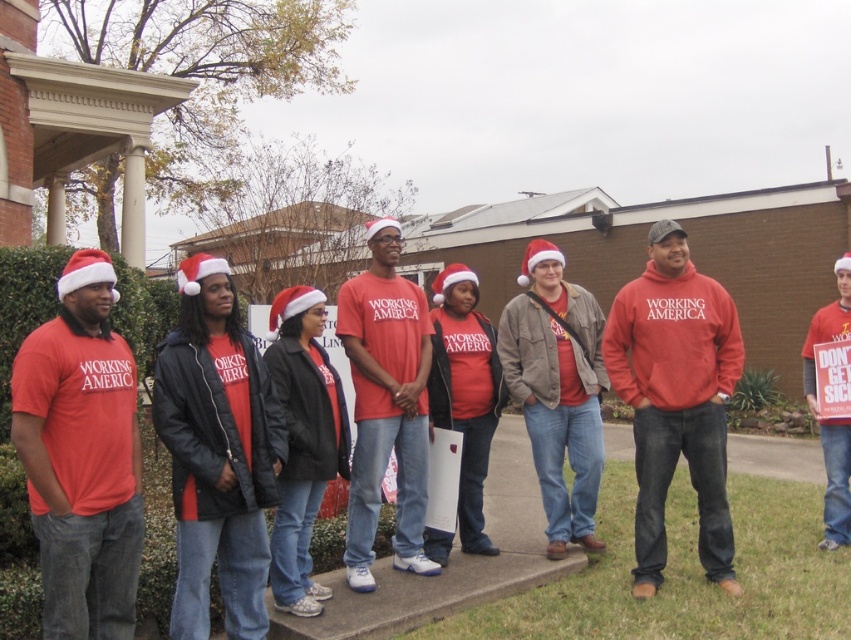
Question: Observing the image, what is the correct spatial positioning of matte red shirt at center in reference to matte red sweatshirt at center?

Choices:
 (A) above
 (B) below

Answer: (A)

Question: Where is matte red t-shirt at center located in relation to matte red sweatshirt at center in the image?

Choices:
 (A) left
 (B) right

Answer: (A)

Question: Considering the real-world distances, which object is farthest from the matte red shirt at center?

Choices:
 (A) matte red t-shirt at center
 (B) red matte sweatshirt at center
 (C) matte red sweatshirt at center

Answer: (C)

Question: Which point appears closest to the camera in this image?

Choices:
 (A) (350, 296)
 (B) (21, 454)
 (C) (840, 333)

Answer: (B)

Question: Does red matte sweatshirt at center appear on the left side of matte red shirt at center?

Choices:
 (A) yes
 (B) no

Answer: (B)

Question: Among these objects, which one is nearest to the camera?

Choices:
 (A) red matte sweatshirt at center
 (B) matte red shirt at center
 (C) matte red sweatshirt at center
 (D) matte red t-shirt at center

Answer: (D)